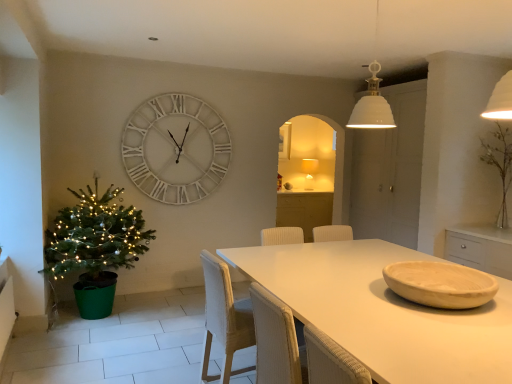
This screenshot has width=512, height=384. I want to click on matte white lampshade at center, so click(309, 172).

Image resolution: width=512 pixels, height=384 pixels. Describe the element at coordinates (95, 247) in the screenshot. I see `green plastic christmas tree at left` at that location.

What do you see at coordinates (224, 318) in the screenshot? I see `woven white chair at center` at bounding box center [224, 318].

The width and height of the screenshot is (512, 384). What do you see at coordinates (383, 311) in the screenshot?
I see `white matte table at center` at bounding box center [383, 311].

Describe the element at coordinates (297, 348) in the screenshot. I see `woven beige armchair at center` at that location.

You are a GUI agent. You are given a task and a screenshot of the screen. Output one action in this format:
    pyautogui.click(x=<x>, y=<y>)
    Task: Click on the matte white lampshade at center
    Image resolution: width=512 pixels, height=384 pixels.
    Given the screenshot: What is the action you would take?
    pyautogui.click(x=309, y=172)

In terms of height, does green plastic christmas tree at left look taller or shorter compared to white matte table at center?

green plastic christmas tree at left is taller than white matte table at center.

Locate an element on the screen. houseplant above the white matte table at center (from a real-world perspective) is located at coordinates (95, 247).

Does green plastic christmas tree at left have a larger size compared to white matte table at center?

No.

Is the position of white wooden clock at upper center less distant than that of matte white lampshade at center?

That is True.

Can you confirm if white wooden clock at upper center is thinner than matte white lampshade at center?

Yes.

Considering the relative sizes of white wooden clock at upper center and matte white lampshade at center in the image provided, is white wooden clock at upper center shorter than matte white lampshade at center?

In fact, white wooden clock at upper center may be taller than matte white lampshade at center.

From a real-world perspective, is woven beige armchair at center on top of green plastic christmas tree at left?

Yes, from a real-world perspective, woven beige armchair at center is above green plastic christmas tree at left.

From the image's perspective, is woven beige armchair at center below green plastic christmas tree at left?

Indeed, from the image's perspective, woven beige armchair at center is shown beneath green plastic christmas tree at left.

Locate an element on the screen. Image resolution: width=512 pixels, height=384 pixels. houseplant lying behind the woven beige armchair at center is located at coordinates (95, 247).

Is woven beige armchair at center aimed at green plastic christmas tree at left?

No, woven beige armchair at center is not turned towards green plastic christmas tree at left.

Considering the sizes of white matte table at center and green plastic christmas tree at left in the image, is white matte table at center bigger or smaller than green plastic christmas tree at left?

Clearly, white matte table at center is larger in size than green plastic christmas tree at left.

Who is taller, white matte table at center or green plastic christmas tree at left?

With more height is green plastic christmas tree at left.

Based on the photo, from the image's perspective, is white matte table at center beneath green plastic christmas tree at left?

Correct, white matte table at center appears lower than green plastic christmas tree at left in the image.

How distant is white matte table at center from green plastic christmas tree at left?

They are 1.89 meters apart.

Considering the positions of objects white wooden clock at upper center and woven white chair at center in the image provided, who is in front, white wooden clock at upper center or woven white chair at center?

woven white chair at center is in front.

Considering the sizes of objects white wooden clock at upper center and woven white chair at center in the image provided, who is wider, white wooden clock at upper center or woven white chair at center?

Wider between the two is woven white chair at center.

Can you see white wooden clock at upper center touching woven white chair at center?

No, white wooden clock at upper center is not in contact with woven white chair at center.

Looking at their sizes, would you say woven white chair at center is wider or thinner than green plastic christmas tree at left?

Considering their sizes, woven white chair at center looks slimmer than green plastic christmas tree at left.

From the image's perspective, which one is positioned higher, woven white chair at center or green plastic christmas tree at left?

green plastic christmas tree at left is shown above in the image.

Where is `houseplant that appears above the woven white chair at center (from a real-world perspective)`? The width and height of the screenshot is (512, 384). houseplant that appears above the woven white chair at center (from a real-world perspective) is located at coordinates (95, 247).

Is woven white chair at center positioned in front of green plastic christmas tree at left?

Yes, the depth of woven white chair at center is less than that of green plastic christmas tree at left.

From a real-world perspective, is green plastic christmas tree at left physically located above or below white wooden clock at upper center?

In terms of real-world spatial position, green plastic christmas tree at left is below white wooden clock at upper center.

Looking at this image, from the image's perspective, relative to white wooden clock at upper center, is green plastic christmas tree at left above or below?

green plastic christmas tree at left is situated lower than white wooden clock at upper center in the image.

Does green plastic christmas tree at left have a greater width compared to white wooden clock at upper center?

Yes.

Which of these two, green plastic christmas tree at left or white wooden clock at upper center, is bigger?

Bigger between the two is green plastic christmas tree at left.

This screenshot has height=384, width=512. I want to click on houseplant above the white matte table at center (from the image's perspective), so click(95, 247).

At what (x,y) coordinates should I click in order to perform the action: click on wall clock on the left of matte white lampshade at center. Please return your answer as a coordinate pair (x, y). This screenshot has height=384, width=512. Looking at the image, I should click on (176, 148).

Which object lies nearer to the anchor point matte white lampshade at center, white matte table at center or matte beige bowl at table center?

Among the two, white matte table at center is located nearer to matte white lampshade at center.

Looking at the image, which one is located further to white matte table at center, white wooden clock at upper center or matte white lampshade at center?

Among the two, matte white lampshade at center is located further to white matte table at center.

Based on their spatial positions, is white matte table at center or woven white chair at center further from white wooden clock at upper center?

woven white chair at center.

Consider the image. Based on their spatial positions, is matte beige bowl at table center or matte white lampshade at center closer to white wooden clock at upper center?

matte white lampshade at center is closer to white wooden clock at upper center.

Considering their positions, is white matte table at center positioned closer to woven white chair at center than green plastic christmas tree at left?

white matte table at center is positioned closer to the anchor woven white chair at center.

From the image, which object appears to be nearer to woven beige armchair at center, woven white chair at center or white wooden clock at upper center?

Based on the image, woven white chair at center appears to be nearer to woven beige armchair at center.

Looking at the image, which one is located closer to white wooden clock at upper center, woven white chair at center or matte white lampshade at center?

matte white lampshade at center is positioned closer to the anchor white wooden clock at upper center.

From the image, which object appears to be farther from matte beige bowl at table center, green plastic christmas tree at left or woven white chair at center?

green plastic christmas tree at left.

You are a GUI agent. You are given a task and a screenshot of the screen. Output one action in this format:
    pyautogui.click(x=<x>, y=<y>)
    Task: Click on the bowl between white matte table at center and matte white lampshade at center in the front-back direction
    The image size is (512, 384).
    Given the screenshot: What is the action you would take?
    pyautogui.click(x=440, y=284)

What are the coordinates of `houseplant between matte beige bowl at table center and matte white lampshade at center from front to back` in the screenshot? It's located at (95, 247).

Locate an element on the screen. This screenshot has height=384, width=512. wall clock positioned between matte beige bowl at table center and matte white lampshade at center from near to far is located at coordinates (176, 148).

You are a GUI agent. You are given a task and a screenshot of the screen. Output one action in this format:
    pyautogui.click(x=<x>, y=<y>)
    Task: Click on the armchair between green plastic christmas tree at left and matte beige bowl at table center from left to right
    The image size is (512, 384).
    Given the screenshot: What is the action you would take?
    pyautogui.click(x=297, y=348)